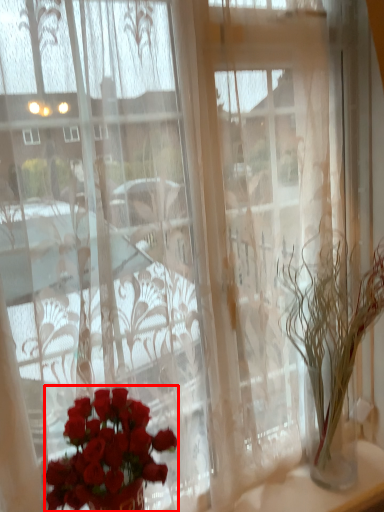
Question: Where is flower (annotated by the red box) located in relation to houseplant in the image?

Choices:
 (A) right
 (B) left

Answer: (B)